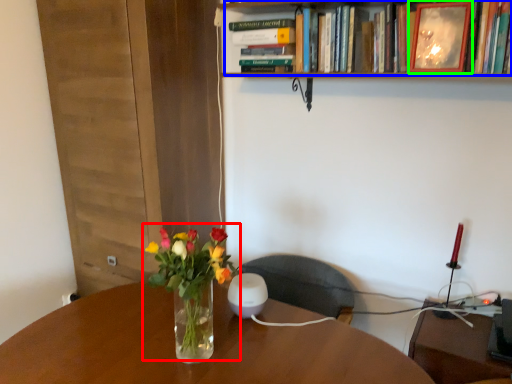
Question: Estimate the real-world distances between objects in this image. Which object is farther from floral arrangement (highlighted by a red box), book (highlighted by a blue box) or picture frame (highlighted by a green box)?

Choices:
 (A) book
 (B) picture frame

Answer: (B)